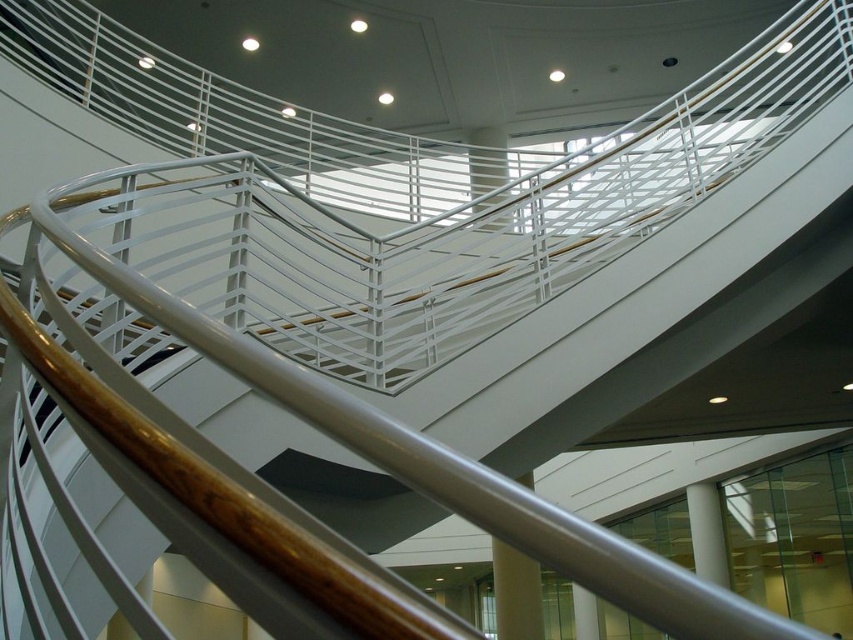
Question: Can you confirm if satin silver pole at center is positioned to the right of white metal/texture pillar at upper center?

Choices:
 (A) yes
 (B) no

Answer: (A)

Question: Which of the following is the farthest from the observer?

Choices:
 (A) white metal/texture pillar at upper center
 (B) satin silver pole at center

Answer: (A)

Question: Does satin silver pole at center have a larger size compared to white metal/texture pillar at upper center?

Choices:
 (A) yes
 (B) no

Answer: (B)

Question: Can you confirm if satin silver pole at center is positioned to the left of white metal/texture pillar at upper center?

Choices:
 (A) yes
 (B) no

Answer: (B)